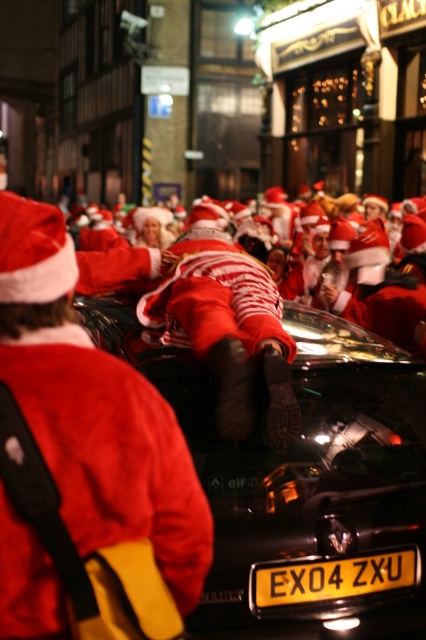
You are a delivery driver who needs to deliver a package to the shiny red santa at center. The GPS shows his coordinates as point 0.522, 0.538. If you are currently at point 0.5, 0.5, which direction should you move to reach him?

The shiny red santa at center is located at point (x=229, y=333), which is northeast of your current position at (x=213, y=320). Move northeast to reach him.

You are a delivery drone trying to navigate between two points in a festive nighttime scene. The first point is at coordinate point(192, 552) and the second is at point(276, 573). According to the scene description, which point is closer to the delivery location if you are approaching from the front of the scene?

Point(192, 552) is in front of point(276, 573), so it is closer to the delivery location when approaching from the front of the scene.